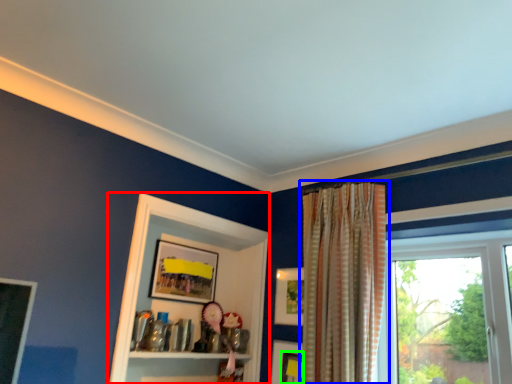
Question: Which object is positioned farthest from cabinet (highlighted by a red box)? Select from curtain (highlighted by a blue box) and picture frame (highlighted by a green box).

Choices:
 (A) curtain
 (B) picture frame

Answer: (A)